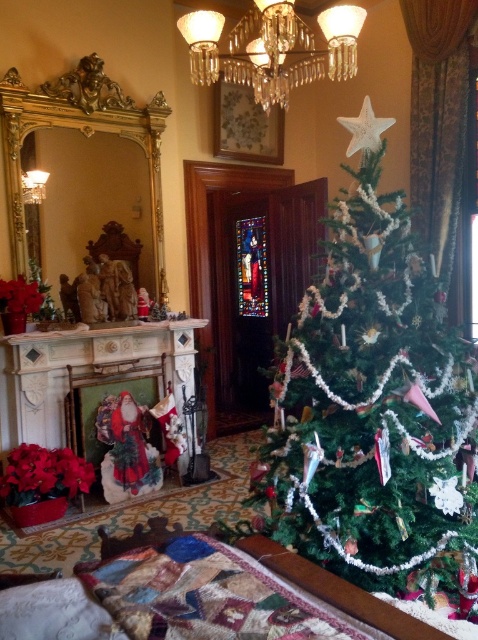
Question: Which point is farther to the camera?

Choices:
 (A) (308, 502)
 (B) (354, 70)

Answer: (B)

Question: Is green matte christmas tree at center wider than clear crystal chandelier at upper center?

Choices:
 (A) no
 (B) yes

Answer: (B)

Question: Is the position of green matte christmas tree at center less distant than that of clear crystal chandelier at upper center?

Choices:
 (A) no
 (B) yes

Answer: (B)

Question: Where is green matte christmas tree at center located in relation to clear crystal chandelier at upper center in the image?

Choices:
 (A) above
 (B) below

Answer: (B)

Question: Among these objects, which one is farthest from the camera?

Choices:
 (A) clear crystal chandelier at upper center
 (B) green matte christmas tree at center

Answer: (A)